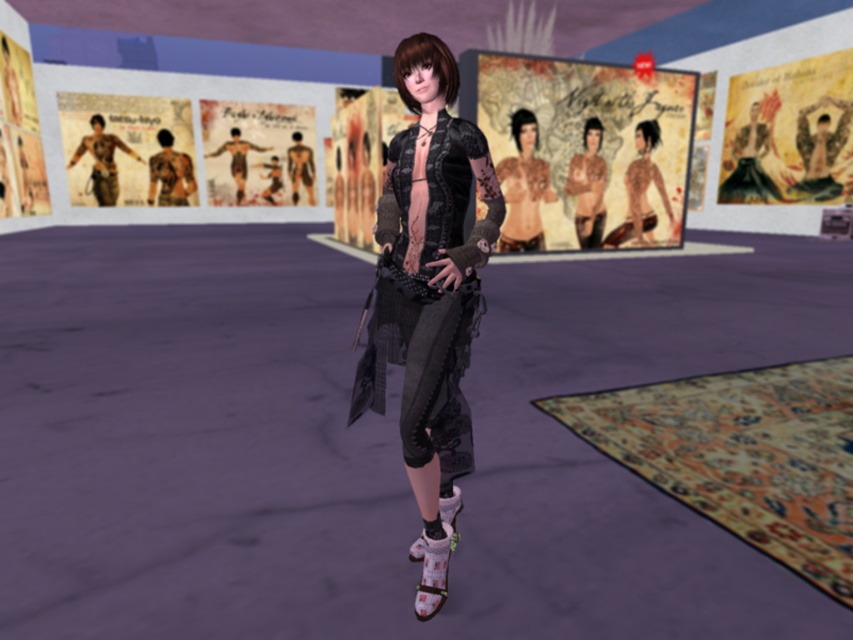
Question: Which object is closer to the camera taking this photo?

Choices:
 (A) velvet-like black jacket at center
 (B) matte black top at center

Answer: (A)

Question: Can you confirm if matte paper poster at upper center is positioned to the left of matte black torso at center?

Choices:
 (A) no
 (B) yes

Answer: (A)

Question: Which point is closer to the camera?

Choices:
 (A) (393, 284)
 (B) (575, 164)
 (C) (548, 164)

Answer: (A)

Question: Does matte black torso at center have a lesser width compared to matte black dress at center?

Choices:
 (A) yes
 (B) no

Answer: (A)

Question: Estimate the real-world distances between objects in this image. Which object is closer to the matte black skin at center?

Choices:
 (A) velvet-like black jacket at center
 (B) matte black dress at center
 (C) matte black top at center
 (D) matte black torso at center

Answer: (D)

Question: In this image, where is matte black skin at center located relative to matte black dress at center?

Choices:
 (A) right
 (B) left

Answer: (B)